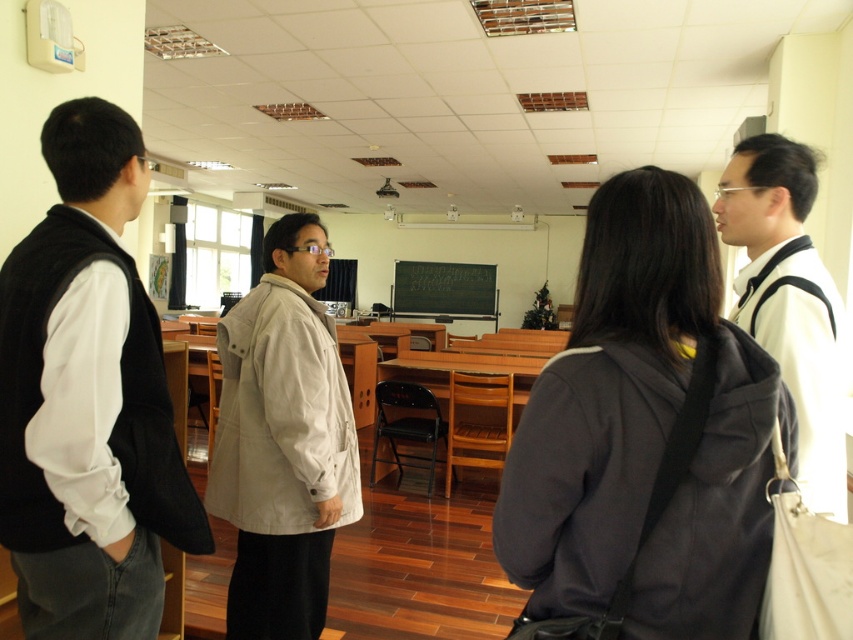
You are a tailor who needs to determine which clothing item requires a wider workspace to handle. You see the dark gray fabric jacket at center and the black wool vest at left. Which one needs more space due to its size?

The dark gray fabric jacket at center requires more space because its width is larger than the black wool vest at left.

You are standing in the classroom and want to locate the black wool vest at left. According to the coordinates given, where should you look relative to the classroom?

The black wool vest at left is located at coordinates 0.625 on the x axis and 0.103 on the y axis, so you should look to the left side of the classroom near the bottom area.